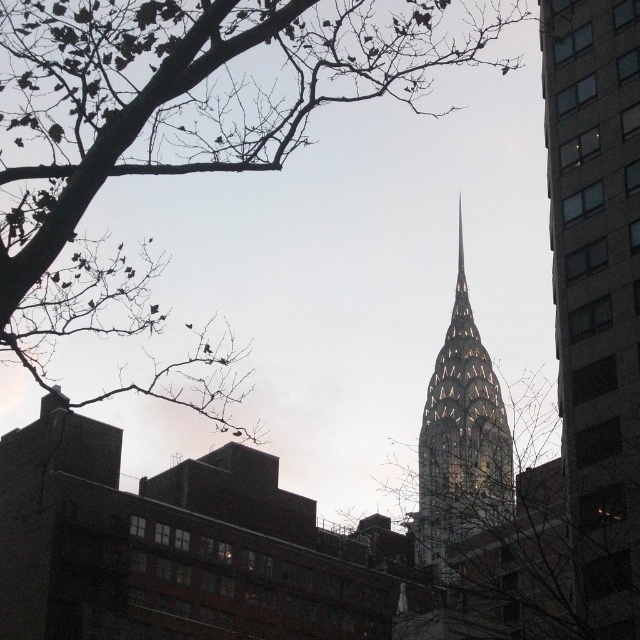
Which of these two, gray concrete building at center or shiny glass tower at center, stands taller?

shiny glass tower at center is taller.

Does point (577, 86) come in front of point (490, 380)?

Yes, it is in front of point (490, 380).

Where is `gray concrete building at center`? gray concrete building at center is located at coordinates (596, 292).

Can you confirm if brown leafy branches at upper left is shorter than shiny glass tower at center?

Incorrect, brown leafy branches at upper left's height does not fall short of shiny glass tower at center's.

Between brown leafy branches at upper left and shiny glass tower at center, which one is positioned higher?

brown leafy branches at upper left is higher up.

Does point (413, 13) come in front of point (454, 452)?

Yes, it is.

Locate an element on the screen. brown leafy branches at upper left is located at coordinates (177, 122).

Who is lower down, brown leafy branches at upper left or gray concrete building at center?

gray concrete building at center is below.

Is the position of brown leafy branches at upper left more distant than that of gray concrete building at center?

No, it is not.

Identify the location of brown leafy branches at upper left. Image resolution: width=640 pixels, height=640 pixels. pos(177,122).